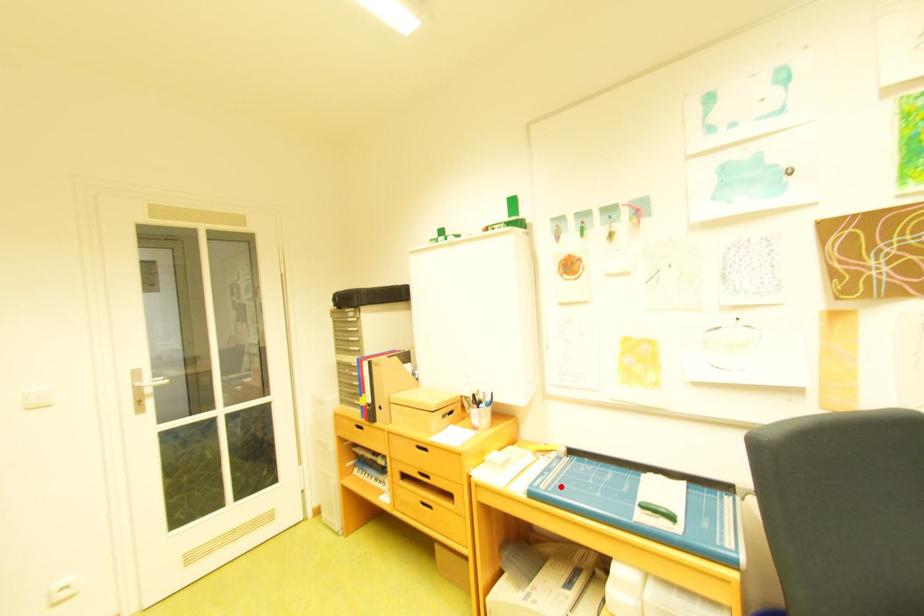
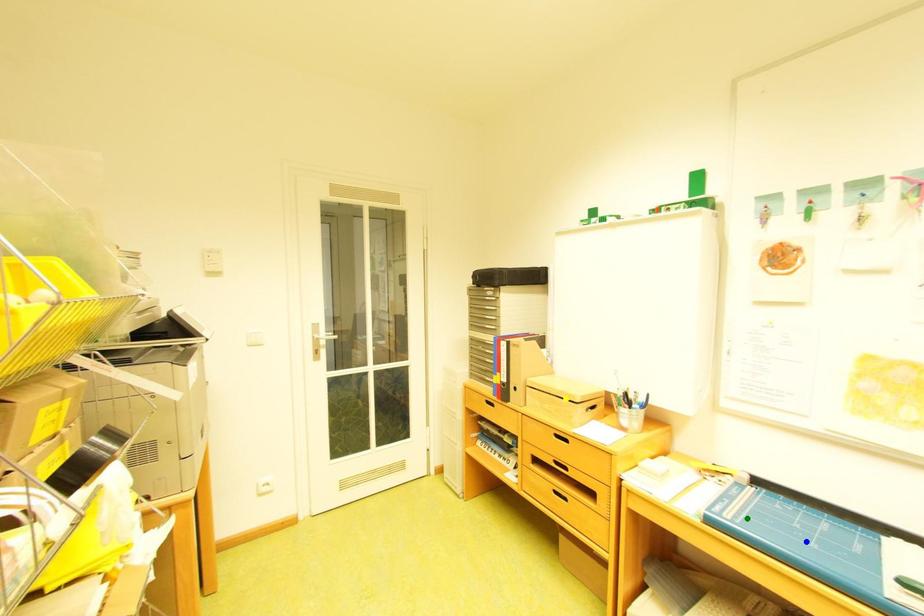
Question: I am providing you with two images of the same scene from different viewpoints. A red point is marked on the first image. You are given multiple points on the second image. Can you choose the point in image 2 that corresponds to the point in image 1?

Choices:
 (A) green point
 (B) yellow point
 (C) blue point

Answer: (A)